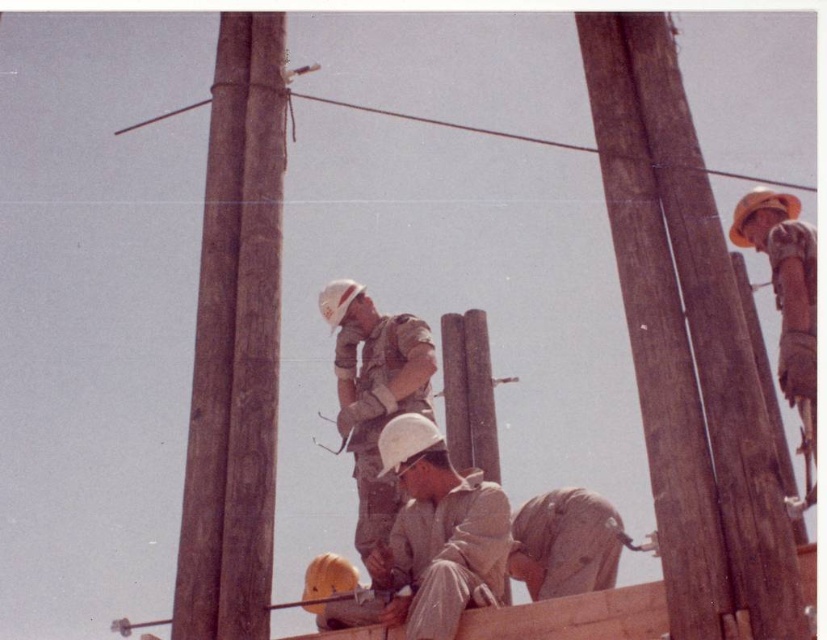
You are a construction worker standing at the point marked by coordinates point (235, 342). You need to reach the brown wood telegraph pole at left. Is the pole directly in front of you, to your left, or to your right?

The point (235, 342) is where the brown wood telegraph pole at left is located, so the pole is directly in front of you.

You are standing at the point labeled point [244,24]. A worker is approaching you from the direction of the utility poles. If the worker is moving towards you at a speed of 1.5 meters per second, how many seconds will it take for them to reach you?

The point labeled point [244,24] is 10.04 meters away from the viewer. Since the worker is moving at 1.5 meters per second, it will take approximately 6.69 seconds to reach the point labeled point [244,24].

You are a construction worker planning to place a new utility pole between the brown wood telegraph pole at left and the brown wooden telegraph pole at right. The new pole must be taller than both existing poles. Which existing pole should you use as a reference to ensure the new pole meets the height requirement?

The brown wooden telegraph pole at right is taller than the brown wood telegraph pole at left. Therefore, the new pole should be taller than the brown wooden telegraph pole at right to meet the requirement.